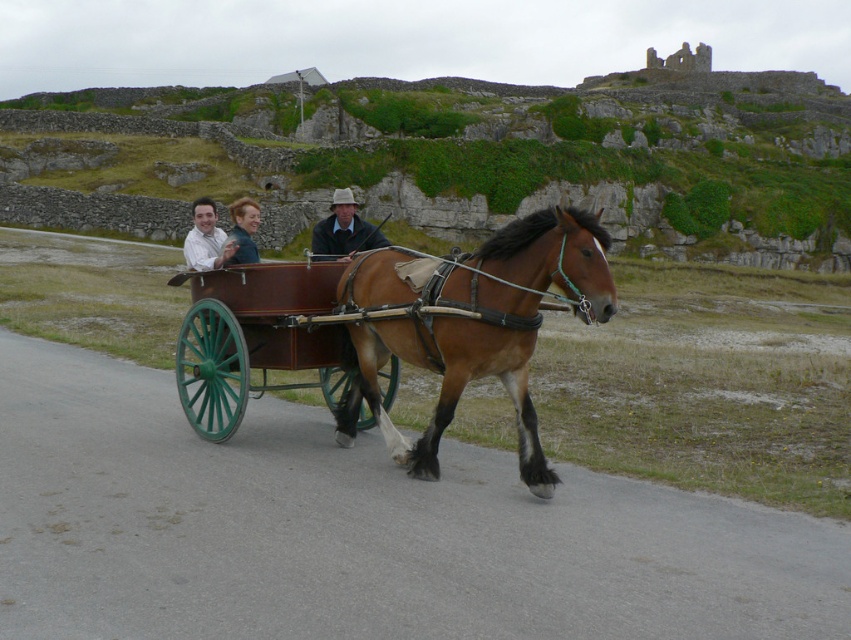
Locate an element on the screen. This screenshot has height=640, width=851. brown glossy horse at center is located at coordinates (472, 326).

Is brown glossy horse at center positioned at the back of blonde hair at center?

No, it is not.

Is point (608, 241) closer to camera compared to point (230, 208)?

That is True.

You are a GUI agent. You are given a task and a screenshot of the screen. Output one action in this format:
    pyautogui.click(x=<x>, y=<y>)
    Task: Click on the brown glossy horse at center
    
    Given the screenshot: What is the action you would take?
    pyautogui.click(x=472, y=326)

Does brown glossy horse at center appear on the right side of light brown leather jacket at center?

Yes, brown glossy horse at center is to the right of light brown leather jacket at center.

Does brown glossy horse at center appear over light brown leather jacket at center?

No, brown glossy horse at center is not above light brown leather jacket at center.

Locate an element on the screen. Image resolution: width=851 pixels, height=640 pixels. brown glossy horse at center is located at coordinates [x=472, y=326].

Is point (324, 252) positioned in front of point (246, 220)?

That is False.

Can you confirm if light brown leather jacket at center is smaller than blonde hair at center?

Correct, light brown leather jacket at center occupies less space than blonde hair at center.

Is point (375, 244) farther from camera compared to point (255, 250)?

Yes.

Where is `light brown leather jacket at center`? The image size is (851, 640). light brown leather jacket at center is located at coordinates (343, 230).